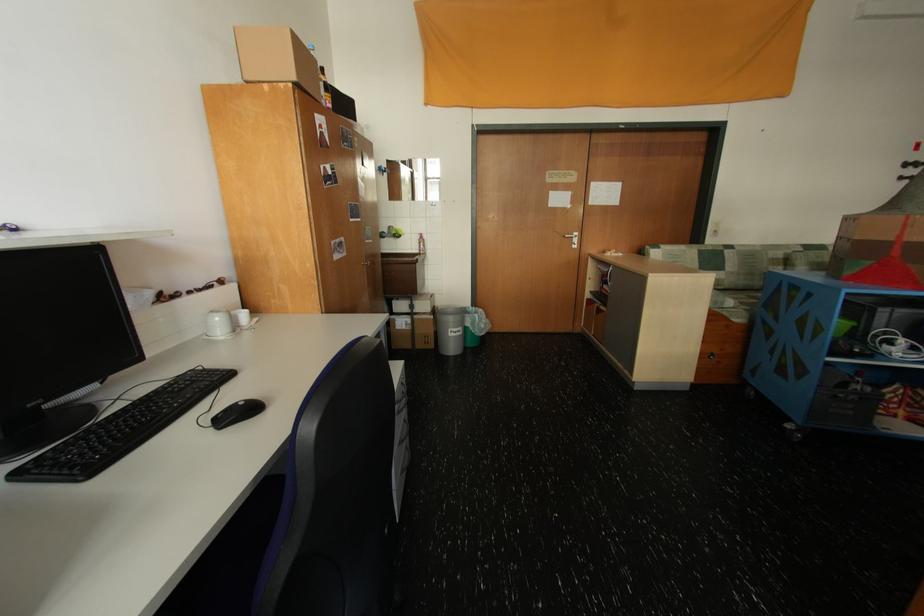
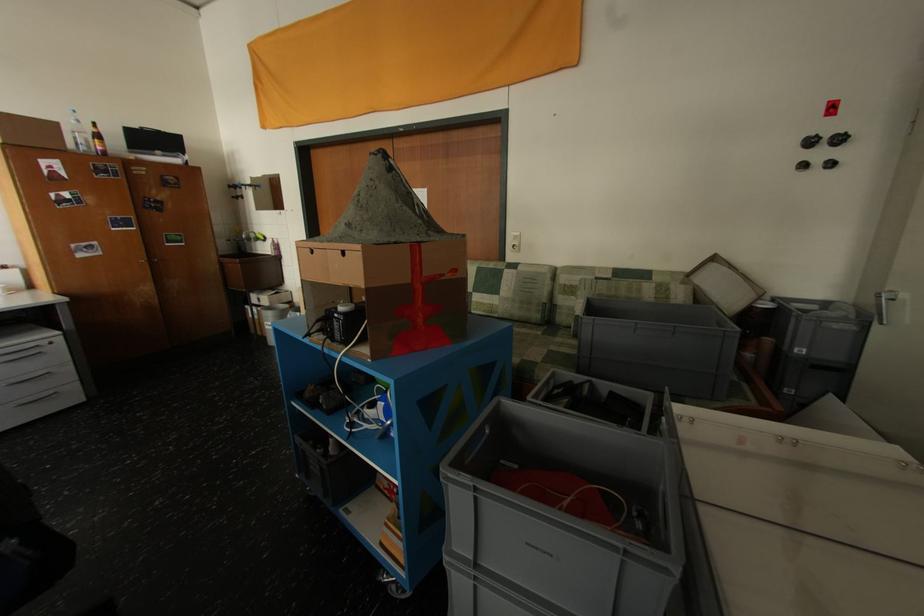
Where in the second image is the point corresponding to (x=410, y=384) from the first image?

(45, 347)